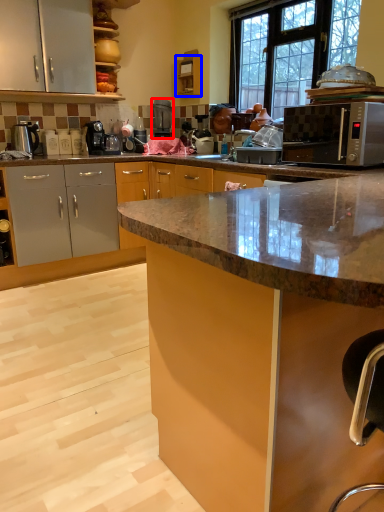
Question: Which point is further to the camera, coffee machine (highlighted by a red box) or cabinetry (highlighted by a blue box)?

Choices:
 (A) coffee machine
 (B) cabinetry

Answer: (A)